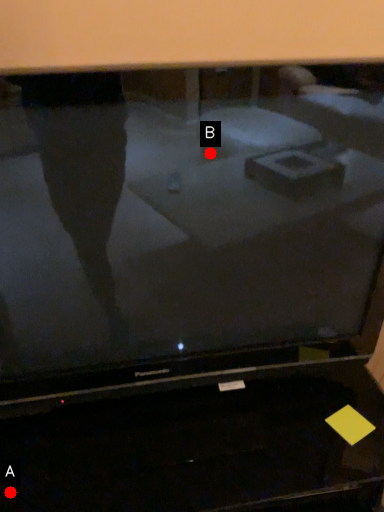
Question: Two points are circled on the image, labeled by A and B beside each circle. Among these points, which one is nearest to the camera?

Choices:
 (A) A is closer
 (B) B is closer

Answer: (B)